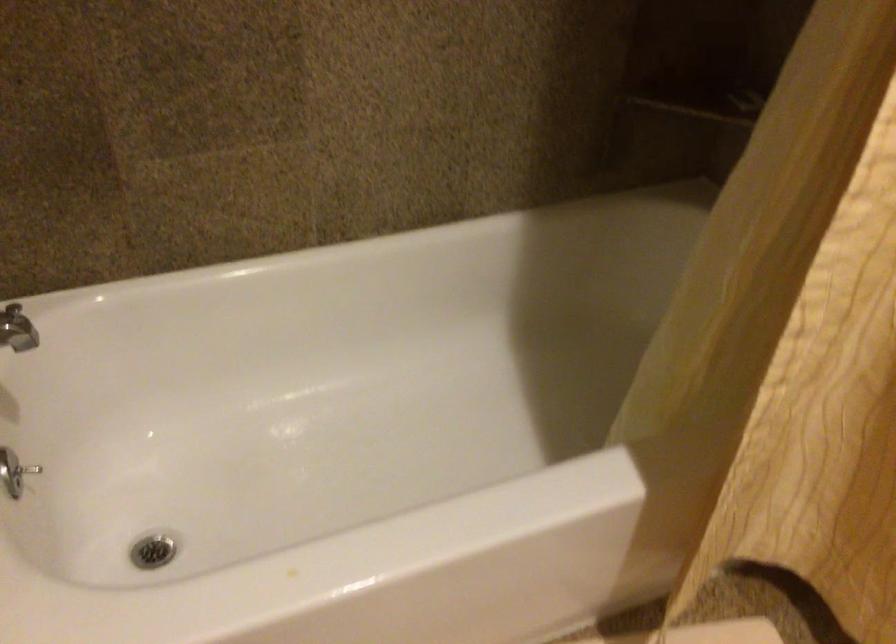
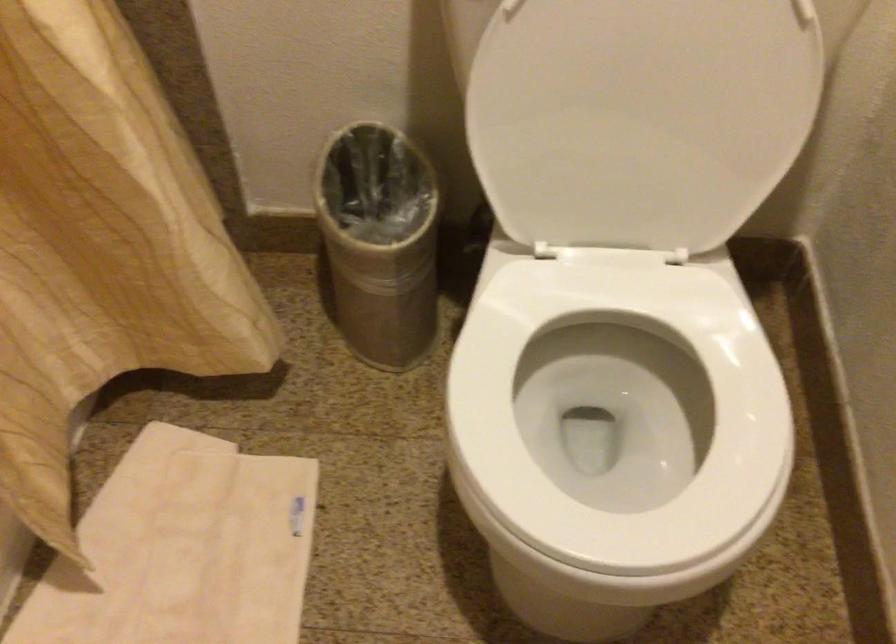
The images are taken continuously from a first-person perspective. In which direction is your viewpoint rotating?

The rotation direction of the camera is right-down.